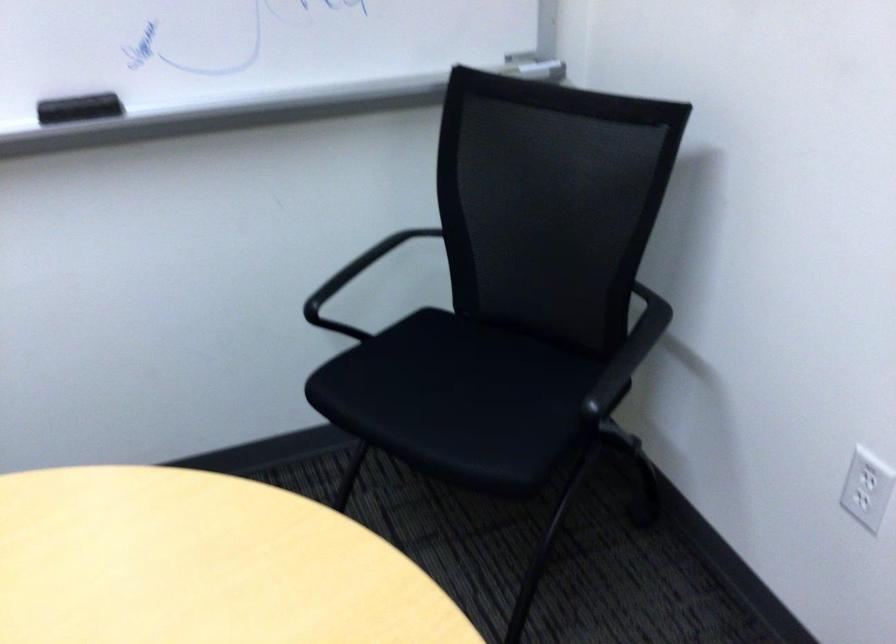
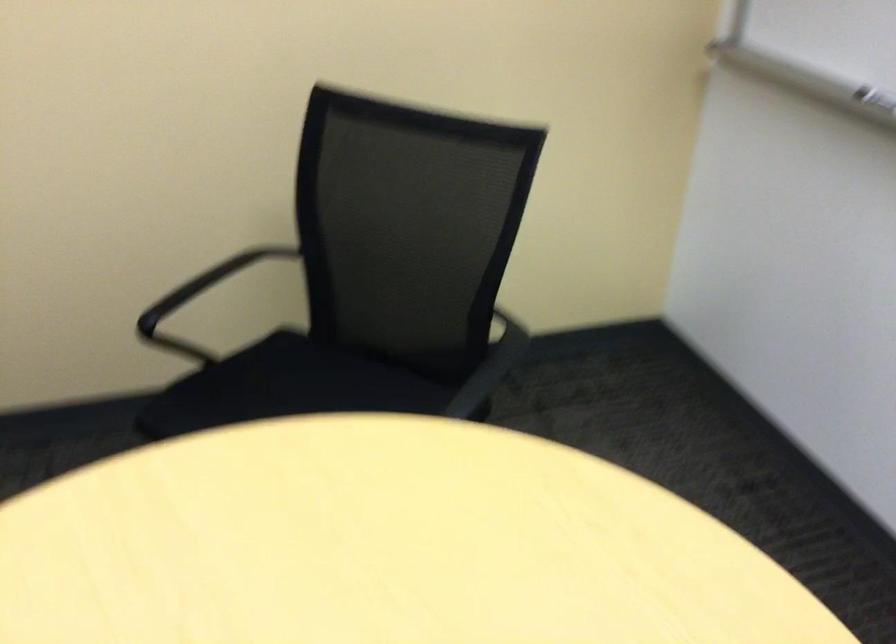
How did the camera likely rotate?

The camera's rotation is toward left-down.